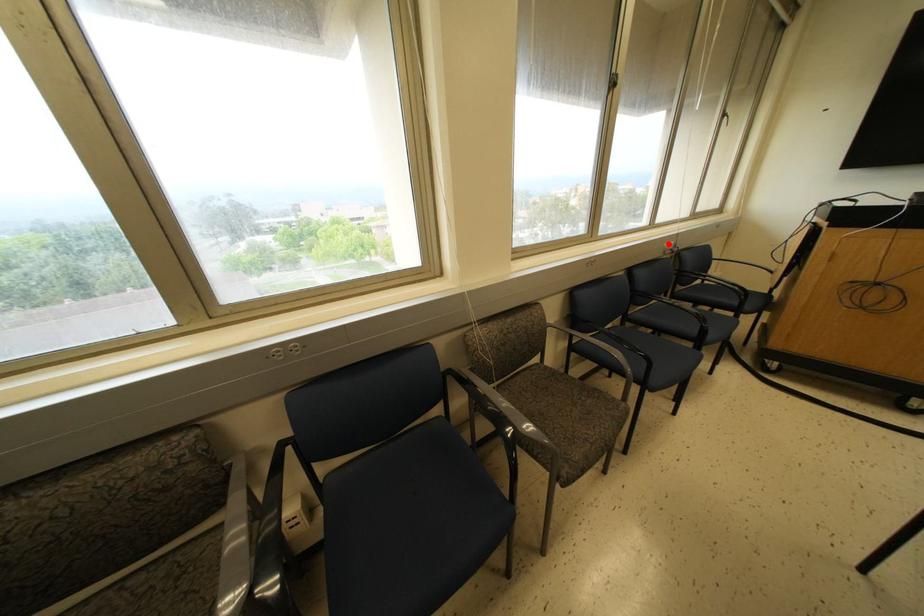
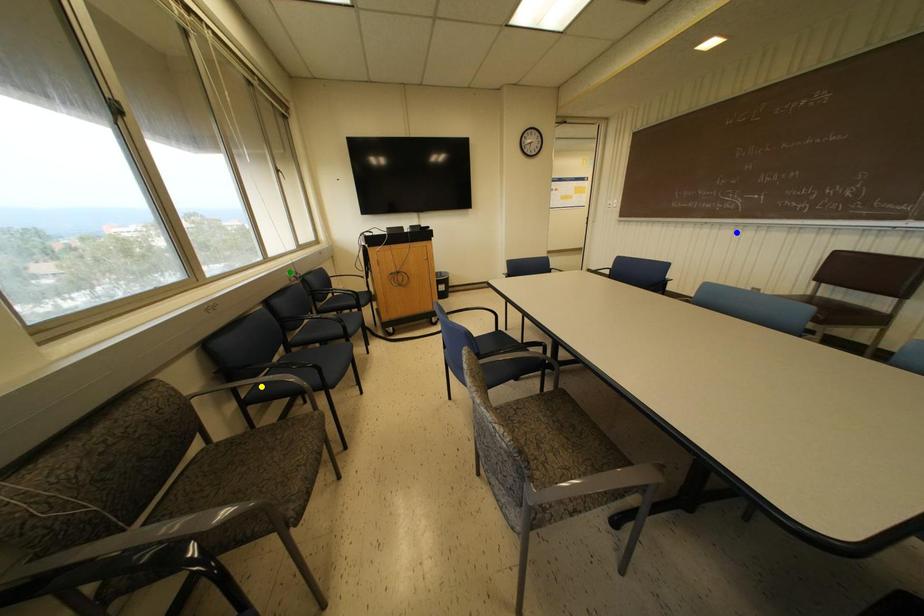
Question: I am providing you with two images of the same scene from different viewpoints. A red point is marked on the first image. You are given multiple points on the second image. Which spot in image 2 lines up with the point in image 1?

Choices:
 (A) yellow point
 (B) blue point
 (C) green point

Answer: (C)